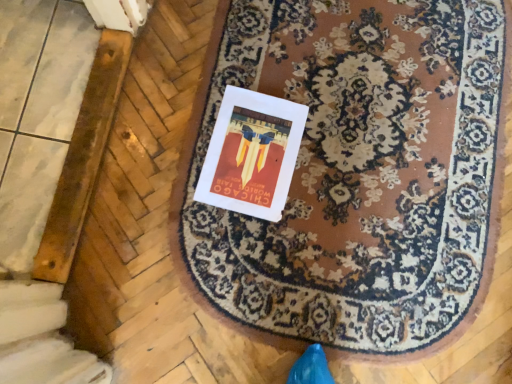
Question: Is brown woolen mat at center thinner than white paper at center?

Choices:
 (A) no
 (B) yes

Answer: (A)

Question: Can you confirm if brown woolen mat at center is shorter than white paper at center?

Choices:
 (A) yes
 (B) no

Answer: (B)

Question: Is brown woolen mat at center surrounding white paper at center?

Choices:
 (A) yes
 (B) no

Answer: (A)

Question: Is brown woolen mat at center not within white paper at center?

Choices:
 (A) yes
 (B) no

Answer: (A)

Question: From the image's perspective, would you say brown woolen mat at center is shown under white paper at center?

Choices:
 (A) no
 (B) yes

Answer: (B)

Question: Is brown woolen mat at center next to white paper at center?

Choices:
 (A) yes
 (B) no

Answer: (B)

Question: From a real-world perspective, is white paper at center located higher than brown woolen mat at center?

Choices:
 (A) no
 (B) yes

Answer: (B)

Question: Does white paper at center have a greater width compared to brown woolen mat at center?

Choices:
 (A) yes
 (B) no

Answer: (B)

Question: Does white paper at center have a lesser width compared to brown woolen mat at center?

Choices:
 (A) no
 (B) yes

Answer: (B)

Question: From the image's perspective, is white paper at center below brown woolen mat at center?

Choices:
 (A) yes
 (B) no

Answer: (B)

Question: Is white paper at center smaller than brown woolen mat at center?

Choices:
 (A) no
 (B) yes

Answer: (B)

Question: Is white paper at center shorter than brown woolen mat at center?

Choices:
 (A) yes
 (B) no

Answer: (A)

Question: Relative to white paper at center, is brown woolen mat at center in front or behind?

Choices:
 (A) front
 (B) behind

Answer: (A)